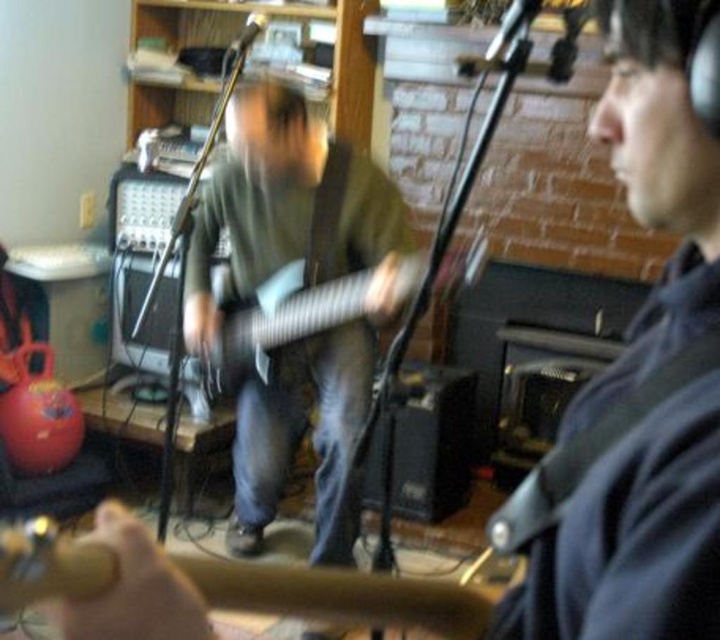
Question: Which point is farther to the camera?

Choices:
 (A) wooden acoustic guitar at center
 (B) metallic silver guitar at center
 (C) dark blue shirt at center

Answer: (B)

Question: Is dark blue shirt at center below metallic silver guitar at center?

Choices:
 (A) yes
 (B) no

Answer: (A)

Question: From the image, what is the correct spatial relationship of dark blue shirt at center in relation to wooden acoustic guitar at center?

Choices:
 (A) above
 (B) below

Answer: (A)

Question: From the image, what is the correct spatial relationship of wooden acoustic guitar at center in relation to metallic silver guitar at center?

Choices:
 (A) below
 (B) above

Answer: (A)

Question: Based on their relative distances, which object is farther from the metallic silver guitar at center?

Choices:
 (A) wooden acoustic guitar at center
 (B) dark blue shirt at center

Answer: (A)

Question: Among these objects, which one is farthest from the camera?

Choices:
 (A) dark blue shirt at center
 (B) wooden acoustic guitar at center
 (C) metallic silver guitar at center

Answer: (C)